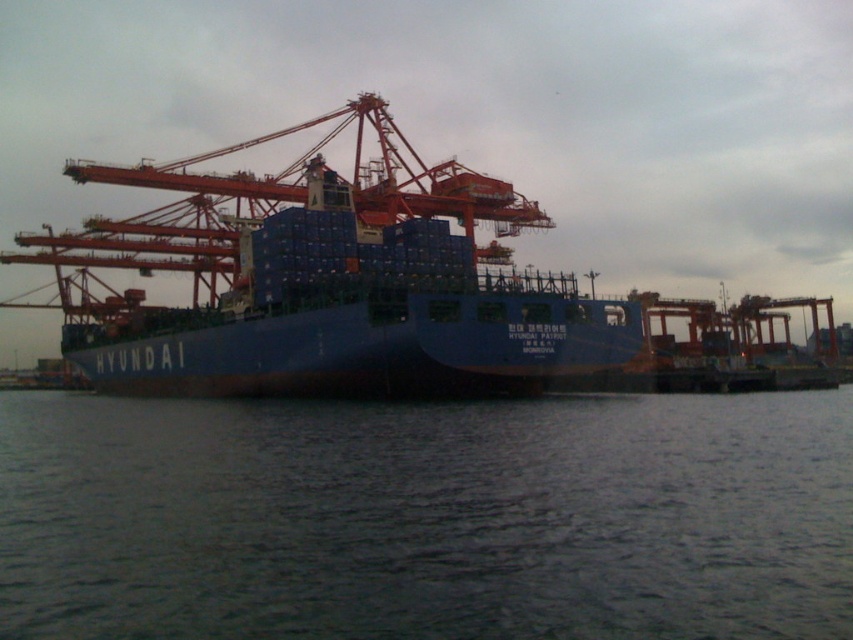
Looking at this image, you are a crane operator trying to position the metallic orange crane at center to load containers onto the HYUNDAI ship. The ship is docked at the port. Based on the scene, where should you position the crane relative to the dark gray water at center to ensure proper alignment?

The dark gray water at center is positioned on the right side of the metallic orange crane at center. To align the crane with the ship, you should position the metallic orange crane at center to the left of the dark gray water at center so that the crane can reach the ship over the water.

Looking at this image, you are standing at the port and want to take a photo of the cargo ship. The camera you are using has a maximum focus range of 300 feet. Will the camera be able to focus on the point at coordinates point (317, 257)?

The distance between point (317, 257) and the camera is 356.55 feet, which exceeds the camera maximum focus range of 300 feet. Therefore, the camera will not be able to focus on the point at coordinates point (317, 257).